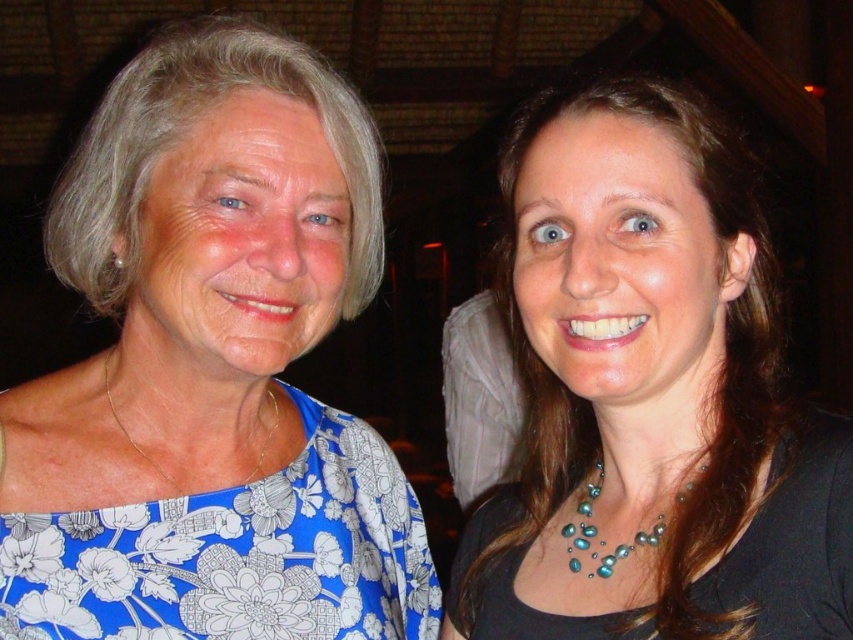
Who is shorter, black matte necklace at upper center or blue floral fabric dress at left?

blue floral fabric dress at left is shorter.

Between black matte necklace at upper center and blue floral fabric dress at left, which one is positioned lower?

Positioned lower is blue floral fabric dress at left.

Between point (503, 552) and point (312, 588), which one is positioned behind?

Point (503, 552)

At what (x,y) coordinates should I click in order to perform the action: click on black matte necklace at upper center. Please return your answer as a coordinate pair (x, y). Looking at the image, I should click on (648, 397).

Can you confirm if pearl-like beads at center is positioned to the right of gold chain necklace at left?

Indeed, pearl-like beads at center is positioned on the right side of gold chain necklace at left.

Which is in front, point (593, 564) or point (158, 474)?

Point (593, 564) is in front.

Identify the location of pearl-like beads at center. This screenshot has height=640, width=853. (596, 532).

Does blue floral fabric dress at left have a greater height compared to teal pearl necklace at center?

Indeed, blue floral fabric dress at left has a greater height compared to teal pearl necklace at center.

Which is above, blue floral fabric dress at left or teal pearl necklace at center?

blue floral fabric dress at left is above.

Consider the image. Who is more forward, (212, 632) or (834, 548)?

Point (834, 548)

You are a GUI agent. You are given a task and a screenshot of the screen. Output one action in this format:
    pyautogui.click(x=<x>, y=<y>)
    Task: Click on the blue floral fabric dress at left
    The width and height of the screenshot is (853, 640).
    Given the screenshot: What is the action you would take?
    point(236,554)